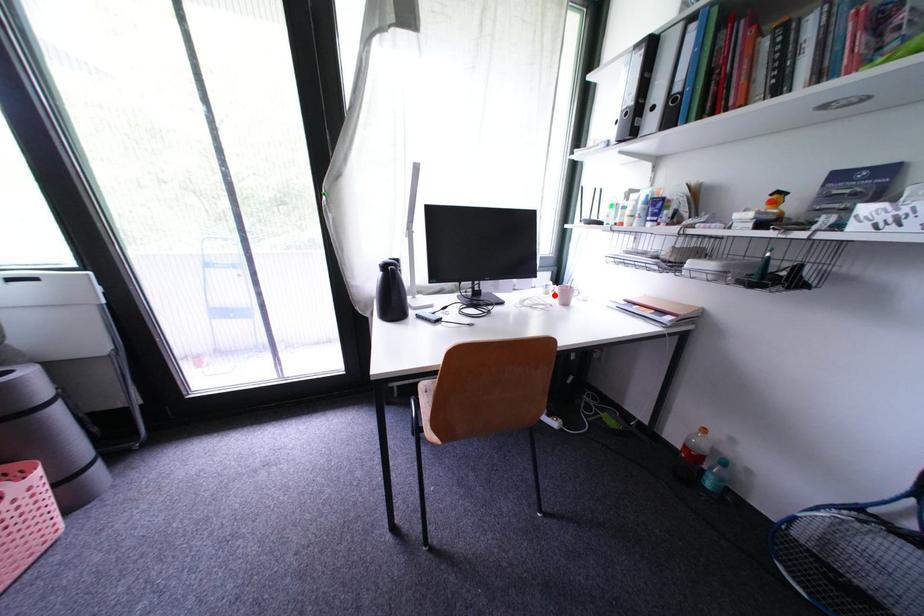
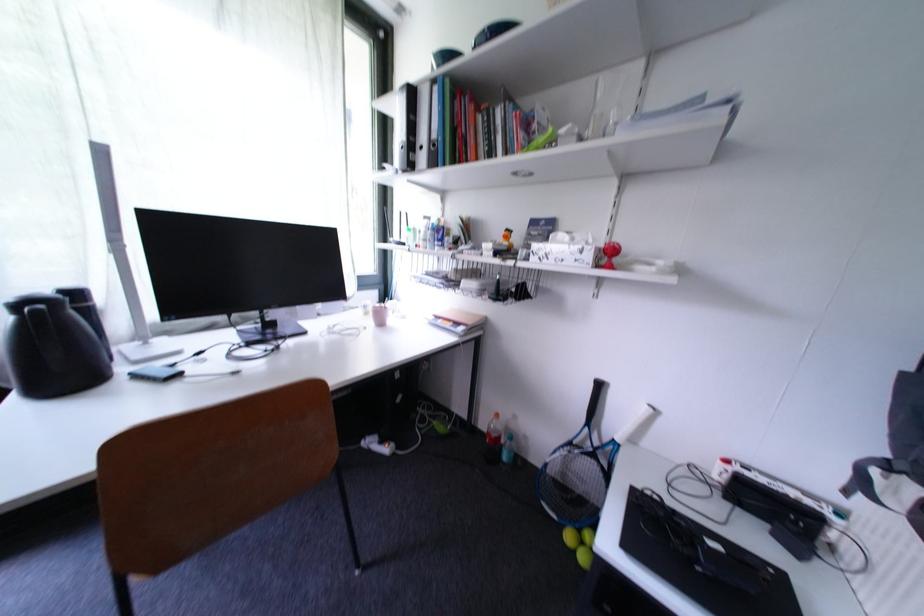
Find the pixel in the second image that matches the highlighted location in the first image.

(373, 315)